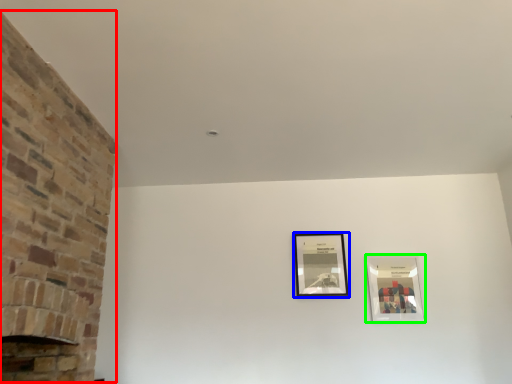
Question: Estimate the real-world distances between objects in this image. Which object is farther from fireplace (highlighted by a red box), picture frame (highlighted by a blue box) or picture frame (highlighted by a green box)?

Choices:
 (A) picture frame
 (B) picture frame

Answer: (B)